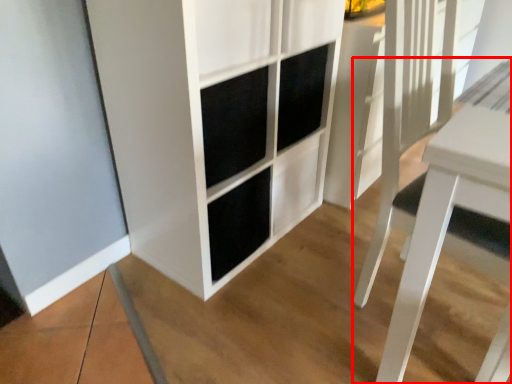
Question: Observing the image, what is the correct spatial positioning of table (annotated by the red box) in reference to cupboard?

Choices:
 (A) right
 (B) left

Answer: (A)